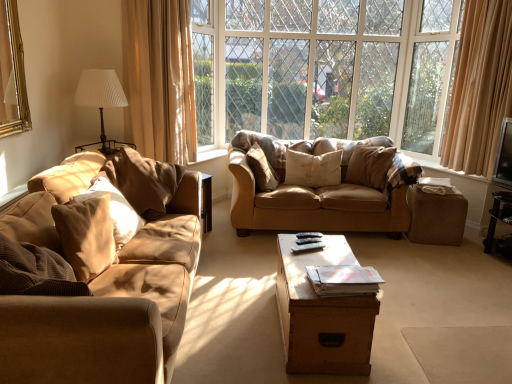
Identify the location of vacant area situated to the left side of wooden trunk at center. Image resolution: width=512 pixels, height=384 pixels. (231, 319).